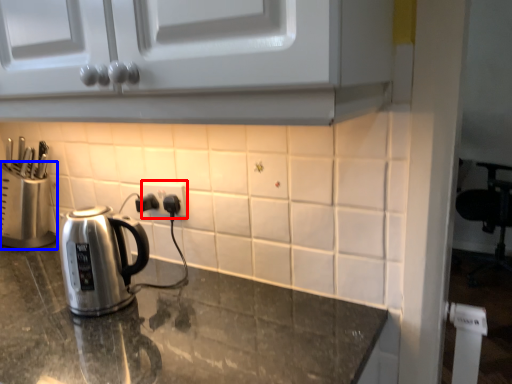
Question: Which point is closer to the camera, electric outlet (highlighted by a red box) or appliance (highlighted by a blue box)?

Choices:
 (A) electric outlet
 (B) appliance

Answer: (A)